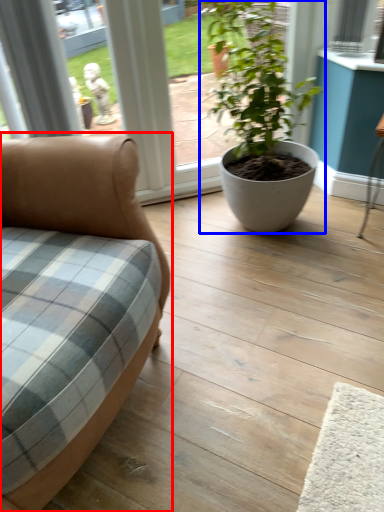
Question: Among these objects, which one is farthest to the camera, studio couch (highlighted by a red box) or houseplant (highlighted by a blue box)?

Choices:
 (A) studio couch
 (B) houseplant

Answer: (B)